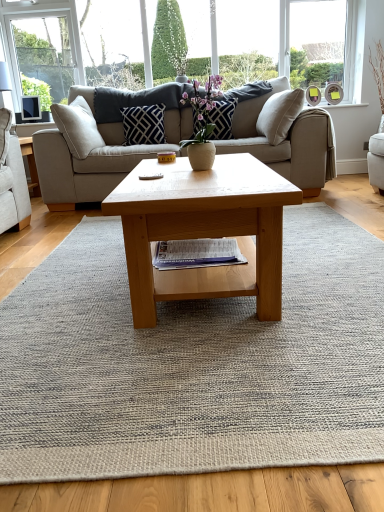
Where is `free spot in front of light brown wooden coffee table at center`? free spot in front of light brown wooden coffee table at center is located at coordinates (194, 376).